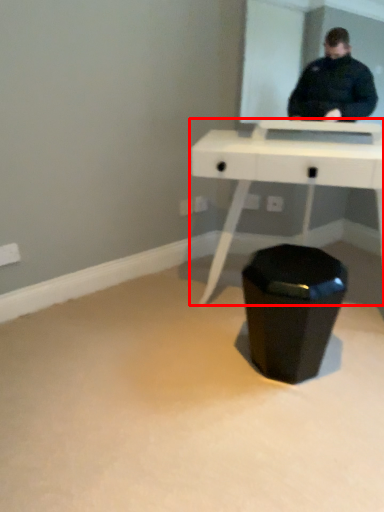
Question: Where is table (annotated by the red box) located in relation to waste container in the image?

Choices:
 (A) right
 (B) left

Answer: (A)